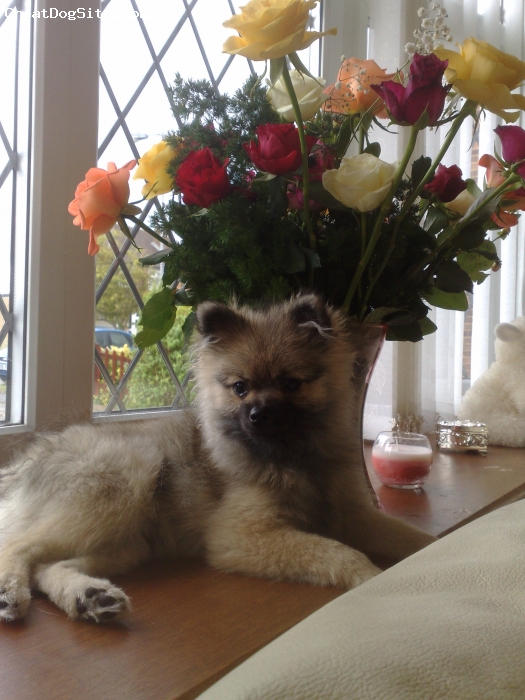
The image size is (525, 700). In order to click on brown wooden table in front of some windows in this screenshot , I will do `click(443, 502)`.